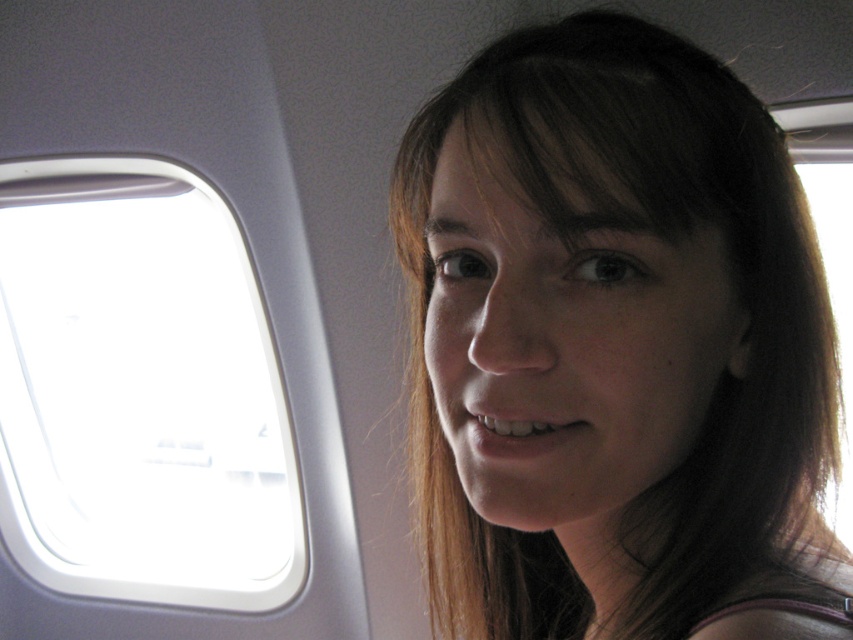
Who is lower down, brown hair at upper center or transparent glass airplane window at upper left?

transparent glass airplane window at upper left

Is point (508, 312) farther from camera compared to point (155, 300)?

No, it is not.

What do you see at coordinates (616, 348) in the screenshot? I see `brown hair at upper center` at bounding box center [616, 348].

Identify the location of brown hair at upper center. This screenshot has width=853, height=640. (616, 348).